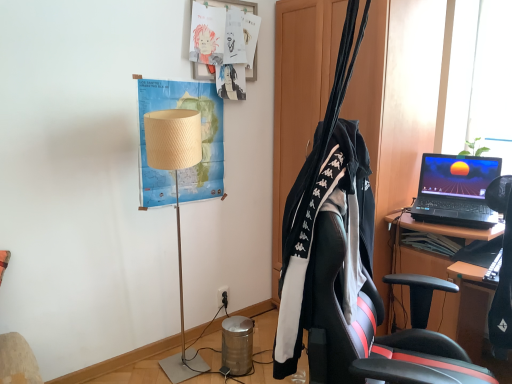
Question: Is matte paper posters at upper center, which is the 1th poster in top-to-bottom order, not close to black plastic power outlet at lower center?

Choices:
 (A) yes
 (B) no

Answer: (A)

Question: From the image's perspective, is matte paper posters at upper center, the second poster when ordered from bottom to top, located above black plastic power outlet at lower center?

Choices:
 (A) no
 (B) yes

Answer: (B)

Question: From a real-world perspective, is matte paper posters at upper center, the second poster when ordered from bottom to top, physically below black plastic power outlet at lower center?

Choices:
 (A) yes
 (B) no

Answer: (B)

Question: From the image's perspective, is matte paper posters at upper center, the second poster when ordered from bottom to top, under black plastic power outlet at lower center?

Choices:
 (A) yes
 (B) no

Answer: (B)

Question: Does matte paper posters at upper center, which is the 1th poster in top-to-bottom order, have a greater height compared to black plastic power outlet at lower center?

Choices:
 (A) no
 (B) yes

Answer: (B)

Question: Is matte paper posters at upper center, which is the 1th poster in top-to-bottom order, to the left of black plastic power outlet at lower center from the viewer's perspective?

Choices:
 (A) no
 (B) yes

Answer: (A)

Question: Can you confirm if black fabric clothesline at center is wider than matte paper posters at upper center, which is the 1th poster in top-to-bottom order?

Choices:
 (A) no
 (B) yes

Answer: (B)

Question: From the image's perspective, is black fabric clothesline at center on top of matte paper posters at upper center, the second poster when ordered from bottom to top?

Choices:
 (A) yes
 (B) no

Answer: (B)

Question: From a real-world perspective, is black fabric clothesline at center below matte paper posters at upper center, the second poster when ordered from bottom to top?

Choices:
 (A) no
 (B) yes

Answer: (B)

Question: Can you confirm if black fabric clothesline at center is positioned to the left of matte paper posters at upper center, the second poster when ordered from bottom to top?

Choices:
 (A) no
 (B) yes

Answer: (A)

Question: Does black fabric clothesline at center lie behind matte paper posters at upper center, the second poster when ordered from bottom to top?

Choices:
 (A) yes
 (B) no

Answer: (B)

Question: Can you confirm if black fabric clothesline at center is shorter than matte paper posters at upper center, which is the 1th poster in top-to-bottom order?

Choices:
 (A) yes
 (B) no

Answer: (B)

Question: Considering the relative positions of beige paper map at upper left, the first poster in the bottom-to-top sequence, and black plastic power outlet at lower center in the image provided, is beige paper map at upper left, the first poster in the bottom-to-top sequence, to the right of black plastic power outlet at lower center from the viewer's perspective?

Choices:
 (A) no
 (B) yes

Answer: (A)